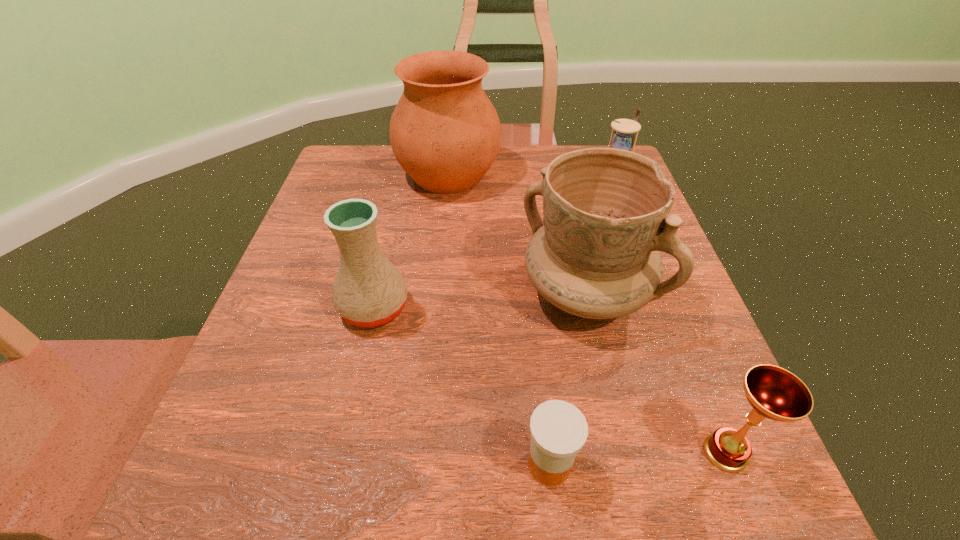
Find the location of a particular element. The image size is (960, 540). blank region between the shortest object and the hourglass is located at coordinates (581, 324).

I want to click on empty location between the chalice and the hourglass, so click(x=668, y=318).

Image resolution: width=960 pixels, height=540 pixels. What are the coordinates of `empty space that is in between the farthest pottery and the hourglass` in the screenshot? It's located at (530, 179).

You are a GUI agent. You are given a task and a screenshot of the screen. Output one action in this format:
    pyautogui.click(x=<x>, y=<y>)
    Task: Click on the vacant region between the chalice and the medicine
    This screenshot has height=540, width=960.
    Given the screenshot: What is the action you would take?
    pyautogui.click(x=637, y=458)

Where is `vacant point located between the hourglass and the chalice`? This screenshot has width=960, height=540. vacant point located between the hourglass and the chalice is located at coordinates (668, 318).

Identify the location of free space between the fourth shortest object and the chalice. [549, 380].

The image size is (960, 540). What are the coordinates of `unoccupied position between the hourglass and the shortest object` in the screenshot? It's located at (581, 324).

You are a GUI agent. You are given a task and a screenshot of the screen. Output one action in this format:
    pyautogui.click(x=<x>, y=<y>)
    Task: Click on the object that is the third closest one to the farthest pottery
    
    Given the screenshot: What is the action you would take?
    pyautogui.click(x=369, y=291)

Select which object is the closest to the medicine. Please provide its 2D coordinates. Your answer should be formatted as a tuple, i.e. [(x, y)], where the tuple contains the x and y coordinates of a point satisfying the conditions above.

[(605, 210)]

Select which pottery is the closest to the hourglass. Please provide its 2D coordinates. Your answer should be formatted as a tuple, i.e. [(x, y)], where the tuple contains the x and y coordinates of a point satisfying the conditions above.

[(605, 210)]